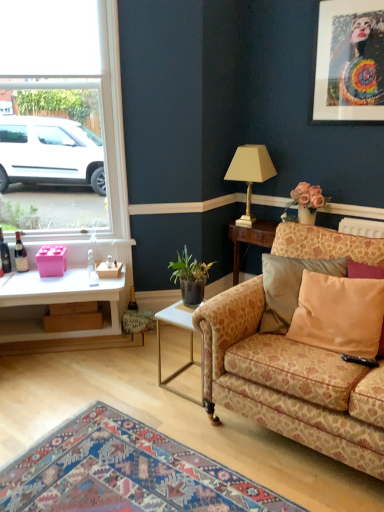
Identify the location of vacant area on the back side of clear glass bottle at left, the 3th bottle when ordered from left to right. (89, 271).